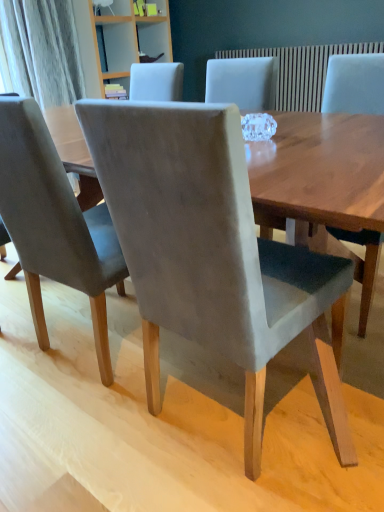
Question: Is suede gray chair at center, arranged as the 2th chair when viewed from the right, bigger than velvet gray chair at center, the first chair from the right?

Choices:
 (A) no
 (B) yes

Answer: (B)

Question: Is suede gray chair at center, the second chair in the left-to-right sequence, smaller than velvet gray chair at center, which is the 3th chair in left-to-right order?

Choices:
 (A) yes
 (B) no

Answer: (B)

Question: Are suede gray chair at center, the second chair in the left-to-right sequence, and velvet gray chair at center, which is the 3th chair in left-to-right order, far apart?

Choices:
 (A) no
 (B) yes

Answer: (A)

Question: Is suede gray chair at center, the second chair in the left-to-right sequence, not within velvet gray chair at center, which is the 3th chair in left-to-right order?

Choices:
 (A) no
 (B) yes

Answer: (B)

Question: Does suede gray chair at center, the second chair in the left-to-right sequence, lie in front of velvet gray chair at center, which is the 3th chair in left-to-right order?

Choices:
 (A) no
 (B) yes

Answer: (B)

Question: Considering the positions of velvet gray chair at center, which is the 3th chair in left-to-right order, and suede gray chair at center, the second chair in the left-to-right sequence, in the image, is velvet gray chair at center, which is the 3th chair in left-to-right order, bigger or smaller than suede gray chair at center, the second chair in the left-to-right sequence,?

Choices:
 (A) big
 (B) small

Answer: (B)

Question: In terms of height, does velvet gray chair at center, which is the 3th chair in left-to-right order, look taller or shorter compared to suede gray chair at center, the second chair in the left-to-right sequence?

Choices:
 (A) short
 (B) tall

Answer: (A)

Question: Is point (357, 240) closer or farther from the camera than point (246, 320)?

Choices:
 (A) closer
 (B) farther

Answer: (B)

Question: Is velvet gray chair at center, the first chair from the right, spatially inside suede gray chair at center, arranged as the 2th chair when viewed from the right, or outside of it?

Choices:
 (A) inside
 (B) outside

Answer: (B)

Question: From the image's perspective, is suede gray chair at center, arranged as the 2th chair when viewed from the right, above or below velvet gray chair at center, which is the 3th chair in left-to-right order?

Choices:
 (A) below
 (B) above

Answer: (A)

Question: Visually, is suede gray chair at center, the second chair in the left-to-right sequence, positioned to the left or to the right of velvet gray chair at center, the first chair from the right?

Choices:
 (A) right
 (B) left

Answer: (B)

Question: Does point (81, 120) appear closer or farther from the camera than point (375, 257)?

Choices:
 (A) farther
 (B) closer

Answer: (B)

Question: Is suede gray chair at center, the second chair in the left-to-right sequence, in front of or behind velvet gray chair at center, the first chair from the right, in the image?

Choices:
 (A) front
 (B) behind

Answer: (A)

Question: Which is correct: suede gray chair at center, the 1th chair viewed from the left, is inside suede gray chair at center, the second chair in the left-to-right sequence, or outside of it?

Choices:
 (A) outside
 (B) inside

Answer: (A)

Question: Is point tap(56, 243) positioned closer to the camera than point tap(185, 206)?

Choices:
 (A) closer
 (B) farther

Answer: (B)